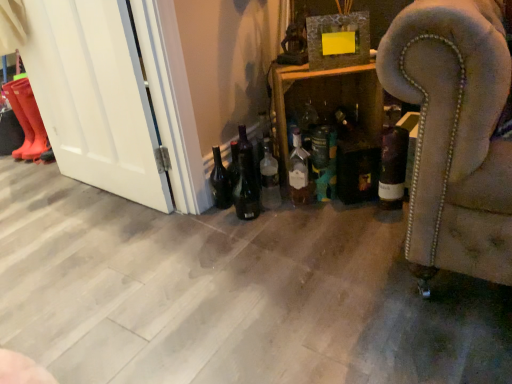
The image size is (512, 384). I want to click on vacant area that lies in front of matte glass bottle at lower left, placed as the 2th beer bottle when sorted from right to left, so click(x=223, y=230).